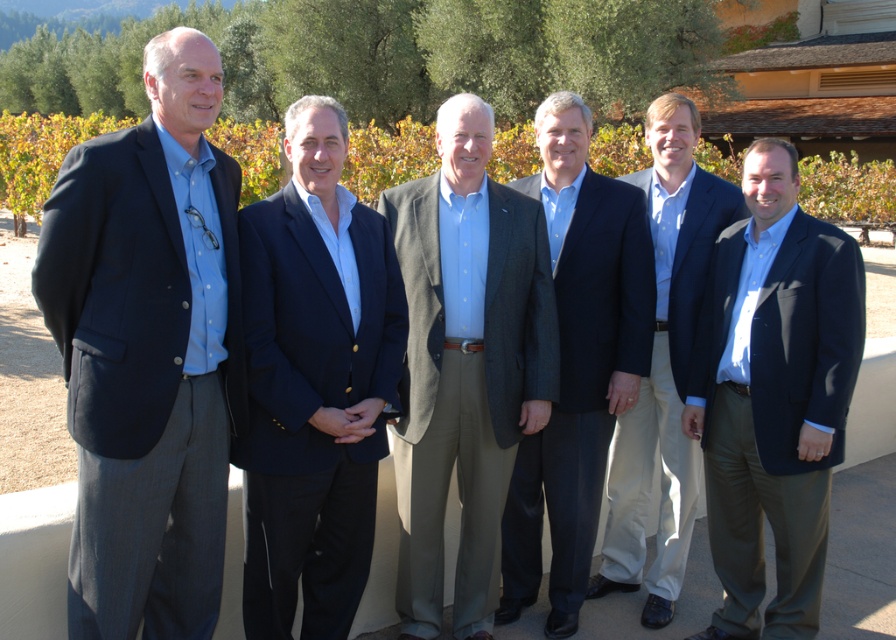
Does point (204, 508) lie behind point (461, 243)?

No, it is not.

Is point (82, 355) farther from camera compared to point (419, 179)?

No, (82, 355) is closer to viewer.

Find the location of `matte blue shirt at left`. matte blue shirt at left is located at coordinates (148, 352).

I want to click on light brown textured blazer at center, so (x=464, y=365).

Describe the element at coordinates (464, 365) in the screenshot. I see `light brown textured blazer at center` at that location.

I want to click on light brown textured blazer at center, so pyautogui.click(x=464, y=365).

Between matte blue shirt at left and matte blue suit at center, which one has more height?

matte blue suit at center is taller.

This screenshot has height=640, width=896. I want to click on matte blue shirt at left, so click(148, 352).